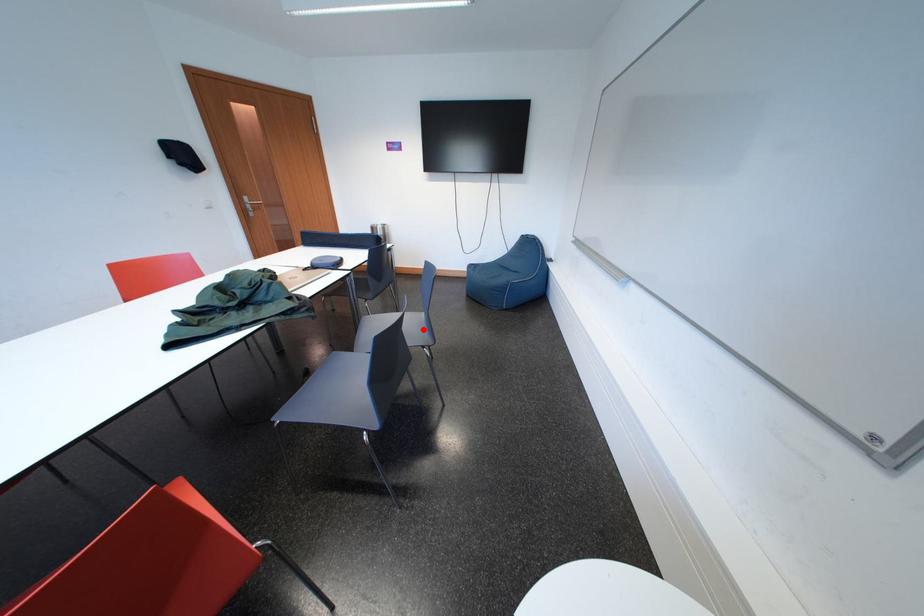
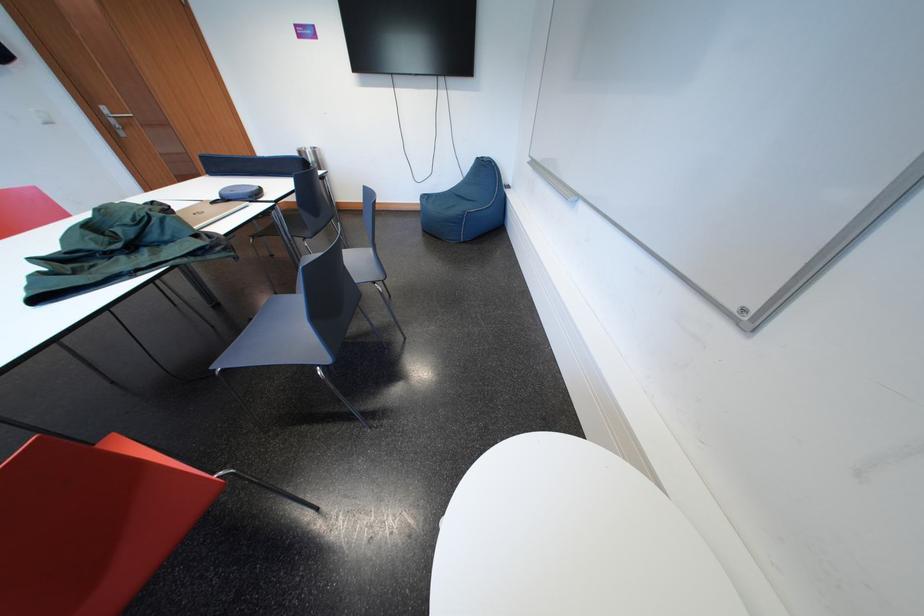
Question: A red point is marked in image1. In image2, is the corresponding 3D point closer to the camera or farther? Reply with the corresponding letter.

Choices:
 (A) The corresponding 3D point is closer.
 (B) The corresponding 3D point is farther.

Answer: (B)